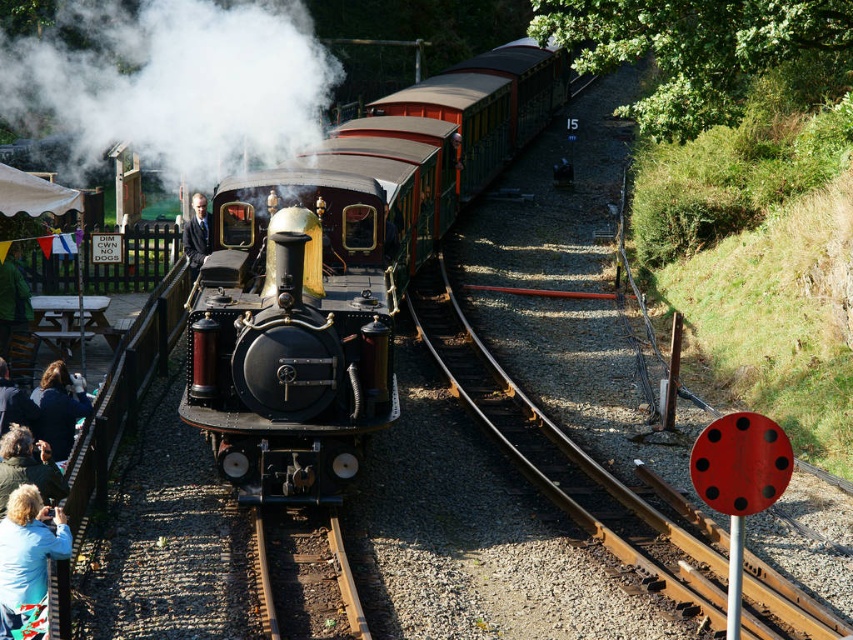
Question: Considering the real-world distances, which object is closest to the white vapor at center?

Choices:
 (A) blue fabric at lower left
 (B) polished brass steam locomotive at center
 (C) green fabric jacket at lower left
 (D) polished brass steam engine at center

Answer: (D)

Question: Which of the following is the farthest from the observer?

Choices:
 (A) polished brass steam locomotive at center
 (B) white vapor at center
 (C) green fabric jacket at lower left
 (D) polished brass steam engine at center

Answer: (B)

Question: Is polished brass steam engine at center positioned before green fabric jacket at lower left?

Choices:
 (A) yes
 (B) no

Answer: (B)

Question: Is the position of dark blue jacket at lower left more distant than that of green fabric jacket at lower left?

Choices:
 (A) no
 (B) yes

Answer: (B)

Question: Does polished brass steam locomotive at center come behind dark blue jacket at lower left?

Choices:
 (A) no
 (B) yes

Answer: (A)

Question: Which is nearer to the dark blue jacket at lower left?

Choices:
 (A) green fabric jacket at lower left
 (B) white vapor at center
 (C) polished brass steam engine at center

Answer: (A)